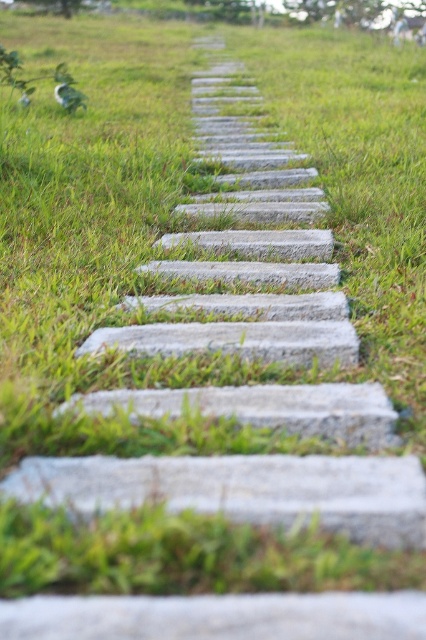
Which of these two, gray stone at center or gray concrete stone at center, stands taller?

Standing taller between the two is gray concrete stone at center.

Does point (377, 508) come behind point (319, 401)?

No, it is in front of (319, 401).

Find the location of a particular element. The width and height of the screenshot is (426, 640). gray stone at center is located at coordinates (244, 490).